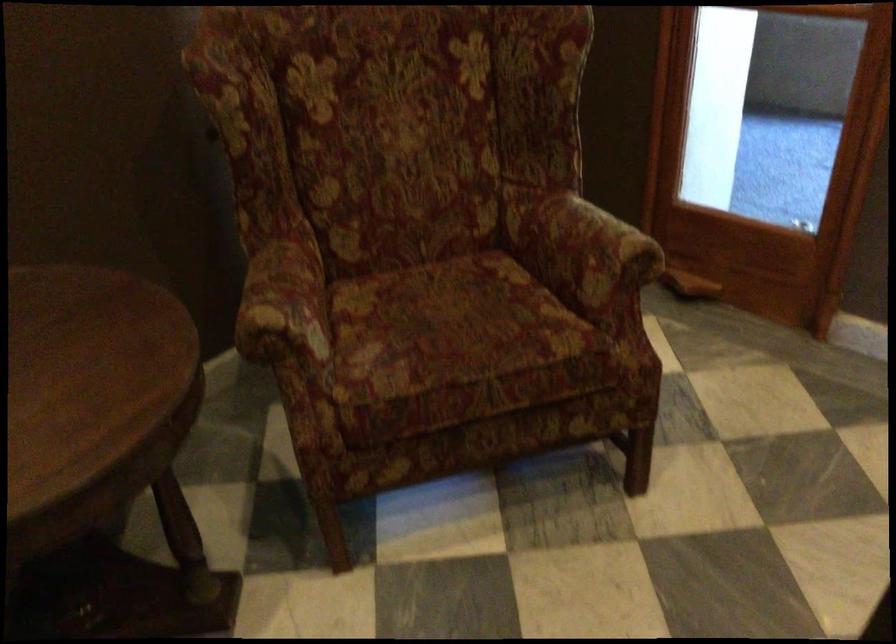
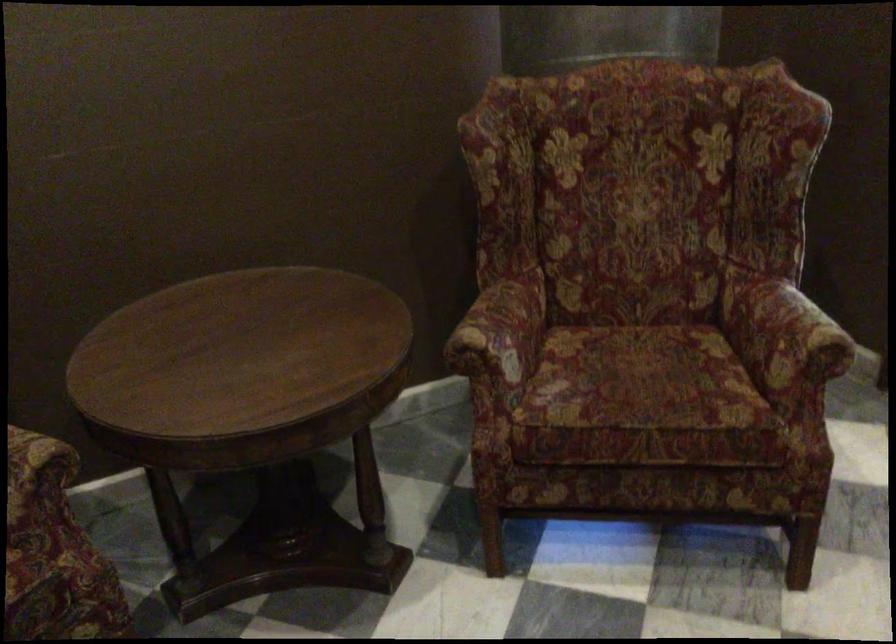
Find the pixel in the second image that matches point 297,303 in the first image.

(501, 330)